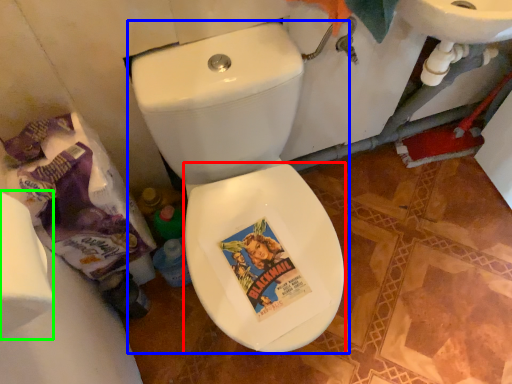
Question: Which object is positioned farthest from bidet (highlighted by a red box)? Select from toilet (highlighted by a blue box) and toilet paper (highlighted by a green box).

Choices:
 (A) toilet
 (B) toilet paper

Answer: (B)